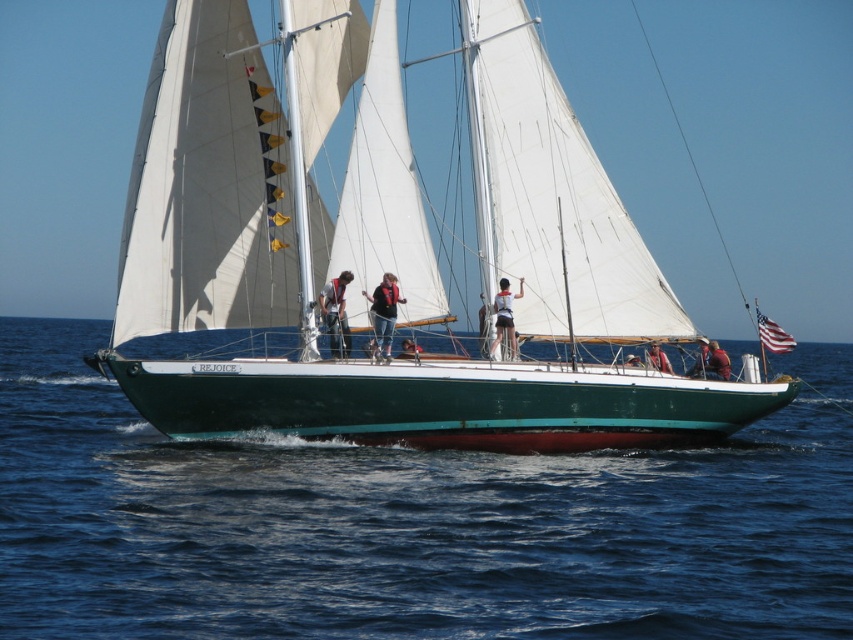
Consider the image. Can you confirm if blue water at center is taller than white matte shorts at center?

Yes.

Can you confirm if blue water at center is positioned to the left of white matte shorts at center?

No, blue water at center is not to the left of white matte shorts at center.

Is point (123, 573) positioned behind point (519, 280)?

No.

Where is `blue water at center`? blue water at center is located at coordinates (401, 525).

Does blue water at center appear on the left side of green matte sailboat at center?

No, blue water at center is not to the left of green matte sailboat at center.

Does point (173, 592) come in front of point (244, 406)?

That is True.

Locate an element on the screen. The height and width of the screenshot is (640, 853). blue water at center is located at coordinates (401, 525).

Does green matte sailboat at center have a smaller size compared to white matte shorts at center?

Incorrect, green matte sailboat at center is not smaller in size than white matte shorts at center.

Can you confirm if green matte sailboat at center is positioned above white matte shorts at center?

Indeed, green matte sailboat at center is positioned over white matte shorts at center.

Who is more forward, (662, 310) or (508, 314)?

Point (508, 314)

Image resolution: width=853 pixels, height=640 pixels. I want to click on green matte sailboat at center, so click(341, 268).